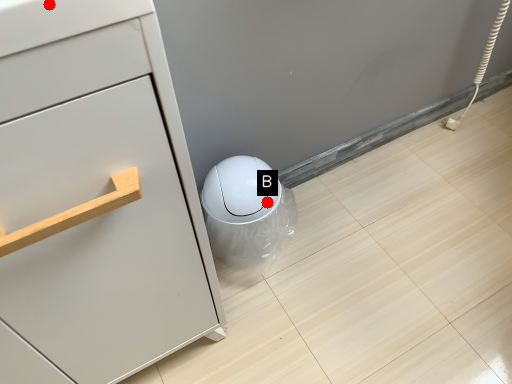
Question: Two points are circled on the image, labeled by A and B beside each circle. Among these points, which one is farthest from the camera?

Choices:
 (A) A is further
 (B) B is further

Answer: (B)